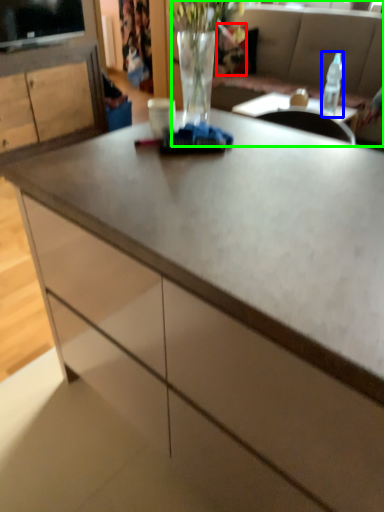
Question: Which object is the farthest from flower (highlighted by a red box)? Choose among these: bottle (highlighted by a blue box) or studio couch (highlighted by a green box).

Choices:
 (A) bottle
 (B) studio couch

Answer: (A)